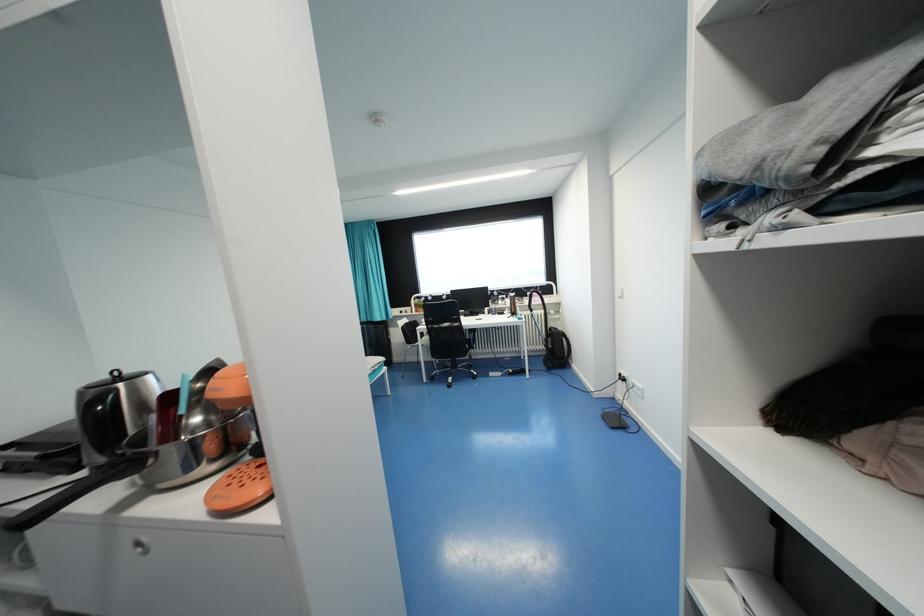
Describe the element at coordinates (140, 546) in the screenshot. I see `a silver drawer handle` at that location.